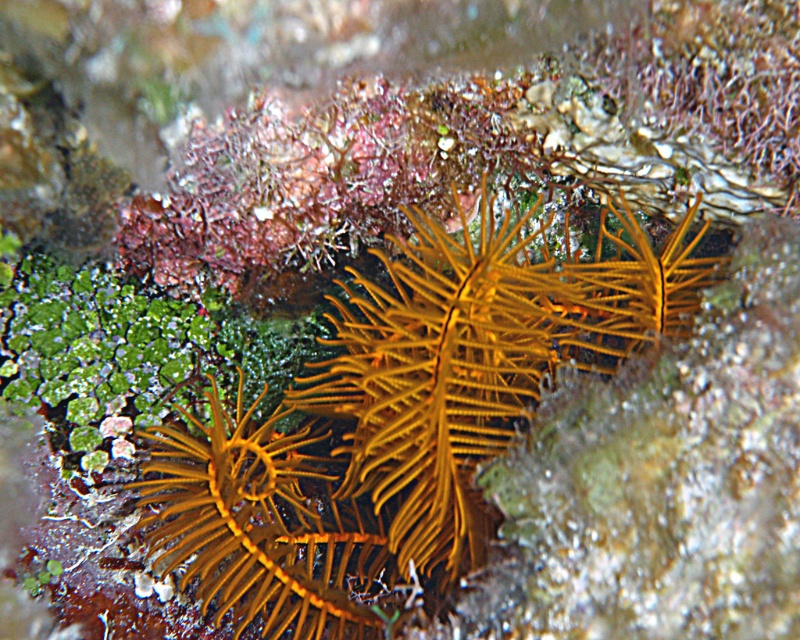
Can you confirm if yellow spiny anemone at center is positioned to the left of yellow matte anemone at center?

Incorrect, yellow spiny anemone at center is not on the left side of yellow matte anemone at center.

Which is more to the right, yellow spiny anemone at center or yellow matte anemone at center?

yellow spiny anemone at center

At what (x,y) coordinates should I click in order to perform the action: click on yellow spiny anemone at center. Please return your answer as a coordinate pair (x, y). Looking at the image, I should click on (480, 355).

Locate an element on the screen. This screenshot has height=640, width=800. yellow spiny anemone at center is located at coordinates (480, 355).